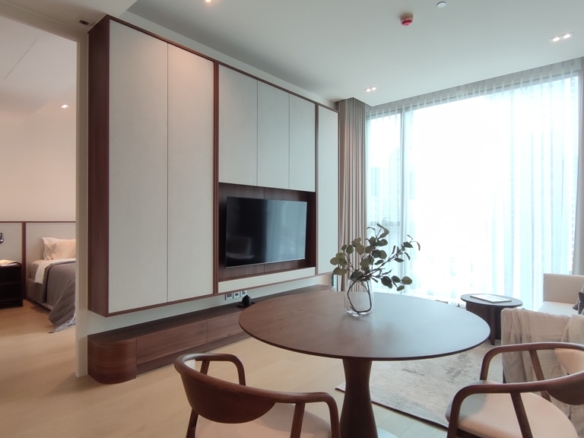
Identify the location of curtain. (505, 199).